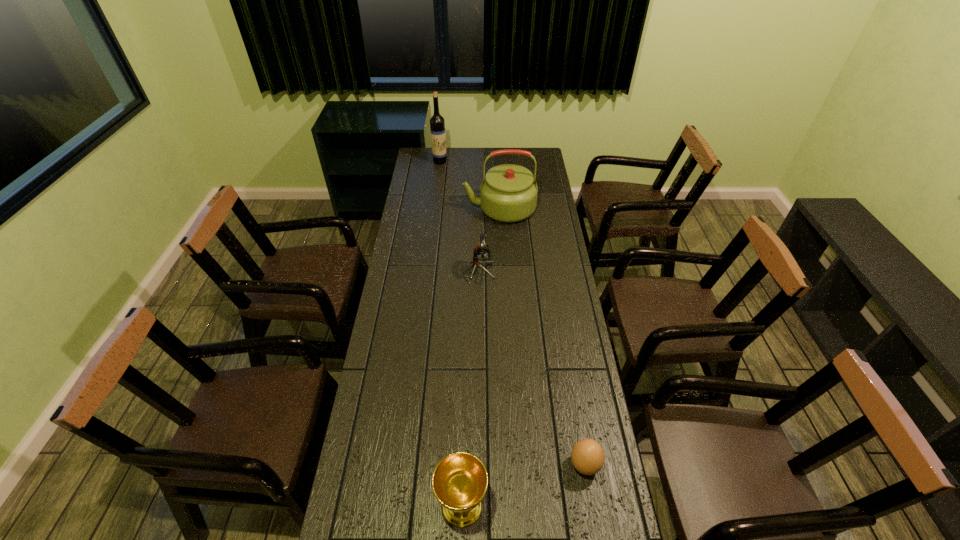
Image resolution: width=960 pixels, height=540 pixels. I want to click on blank space at the left edge, so click(431, 179).

In the image, there is a desktop. Identify the location of vacant space at the right edge. The width and height of the screenshot is (960, 540). (567, 477).

At what (x,y) coordinates should I click in order to perform the action: click on vacant space at the far right corner. Please return your answer as a coordinate pair (x, y). Looking at the image, I should click on (540, 148).

This screenshot has width=960, height=540. In order to click on empty location between the tallest object and the shortest object in this screenshot , I will do `click(513, 313)`.

What are the coordinates of `vacant space that's between the boiled egg and the fourth shortest object` in the screenshot? It's located at tap(542, 337).

This screenshot has height=540, width=960. I want to click on vacant space that's between the kettle and the third farthest object, so coord(490,241).

Image resolution: width=960 pixels, height=540 pixels. I want to click on vacant area that lies between the wine bottle and the fourth shortest object, so click(x=469, y=185).

This screenshot has height=540, width=960. Find the location of `free area in between the chalice and the second tallest object`. free area in between the chalice and the second tallest object is located at coordinates (481, 357).

This screenshot has width=960, height=540. In order to click on vacant region between the fourth shortest object and the earphone in this screenshot , I will do `click(490, 241)`.

You are a GUI agent. You are given a task and a screenshot of the screen. Output one action in this format:
    pyautogui.click(x=<x>, y=<y>)
    Task: Click on the empty space that is in between the boiled egg and the earphone
    The width and height of the screenshot is (960, 540).
    Given the screenshot: What is the action you would take?
    pyautogui.click(x=532, y=369)